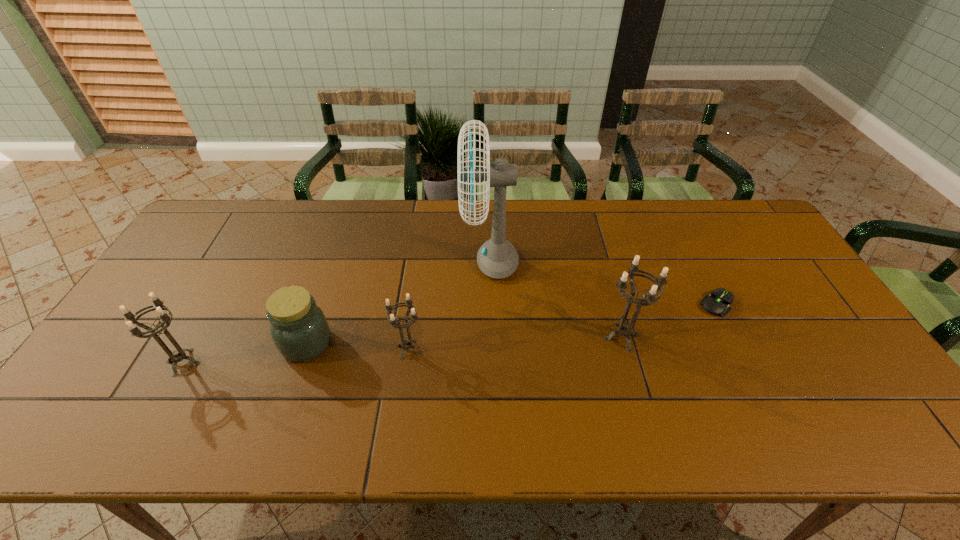
Select which candle holder is the closest to the third tallest object. Please provide its 2D coordinates. Your answer should be formatted as a tuple, i.e. [(x, y)], where the tuple contains the x and y coordinates of a point satisfying the conditions above.

[(406, 343)]

Locate which candle holder ranks in proximity to the second candle holder from right to left. Please provide its 2D coordinates. Your answer should be formatted as a tuple, i.e. [(x, y)], where the tuple contains the x and y coordinates of a point satisfying the conditions above.

[(625, 329)]

Where is `free space that satisfies the following two spatial constraints: 1. on the back side of the leftmost object; 2. on the right side of the second object from left to right`? Image resolution: width=960 pixels, height=540 pixels. free space that satisfies the following two spatial constraints: 1. on the back side of the leftmost object; 2. on the right side of the second object from left to right is located at coordinates (194, 343).

Find the location of a particular element. The width and height of the screenshot is (960, 540). vacant area in the image that satisfies the following two spatial constraints: 1. on the front-facing side of the fan; 2. on the left side of the rightmost candle holder is located at coordinates (492, 337).

You are a GUI agent. You are given a task and a screenshot of the screen. Output one action in this format:
    pyautogui.click(x=<x>, y=<y>)
    Task: Click on the free spot that satisfies the following two spatial constraints: 1. on the back side of the leftmost object; 2. on the right side of the second object from right to left
    Image resolution: width=960 pixels, height=540 pixels.
    Given the screenshot: What is the action you would take?
    pyautogui.click(x=198, y=337)